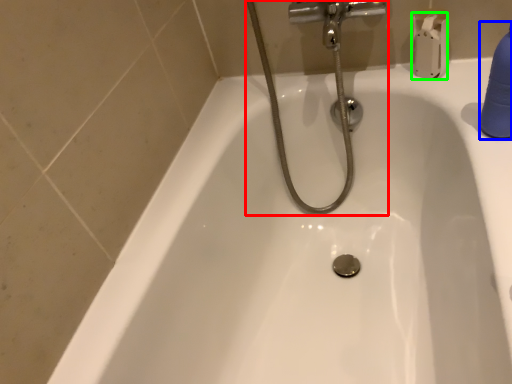
Question: Which object is the farthest from plumbing fixture (highlighted by a red box)? Choose among these: cleaning product (highlighted by a blue box) or toilet paper (highlighted by a green box).

Choices:
 (A) cleaning product
 (B) toilet paper

Answer: (A)